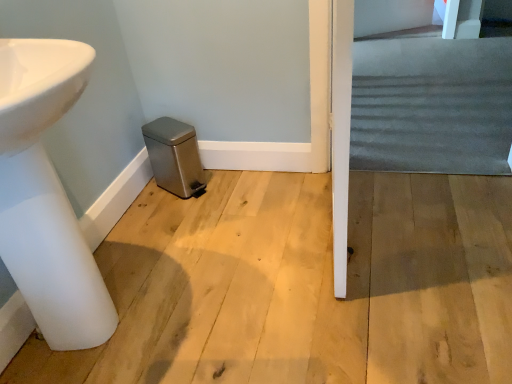
Question: From the image's perspective, is dark gray carpet at right located above or below white glossy sink at lower left?

Choices:
 (A) below
 (B) above

Answer: (B)

Question: Considering the positions of point (506, 139) and point (53, 216), is point (506, 139) closer or farther from the camera than point (53, 216)?

Choices:
 (A) farther
 (B) closer

Answer: (A)

Question: Considering the positions of dark gray carpet at right and white glossy sink at lower left in the image, is dark gray carpet at right wider or thinner than white glossy sink at lower left?

Choices:
 (A) thin
 (B) wide

Answer: (B)

Question: From the image's perspective, is white glossy sink at lower left above or below dark gray carpet at right?

Choices:
 (A) above
 (B) below

Answer: (B)

Question: Is point (24, 211) positioned closer to the camera than point (497, 162)?

Choices:
 (A) closer
 (B) farther

Answer: (A)

Question: Considering the positions of white glossy sink at lower left and dark gray carpet at right in the image, is white glossy sink at lower left wider or thinner than dark gray carpet at right?

Choices:
 (A) thin
 (B) wide

Answer: (A)

Question: In the image, is white glossy sink at lower left positioned in front of or behind dark gray carpet at right?

Choices:
 (A) behind
 (B) front

Answer: (B)